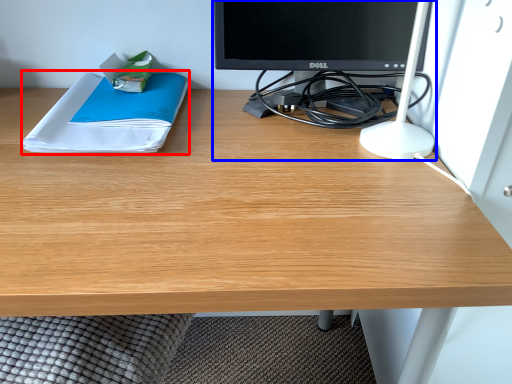
Question: Which object is closer to the camera taking this photo, paperback book (highlighted by a red box) or desktop computer (highlighted by a blue box)?

Choices:
 (A) paperback book
 (B) desktop computer

Answer: (B)